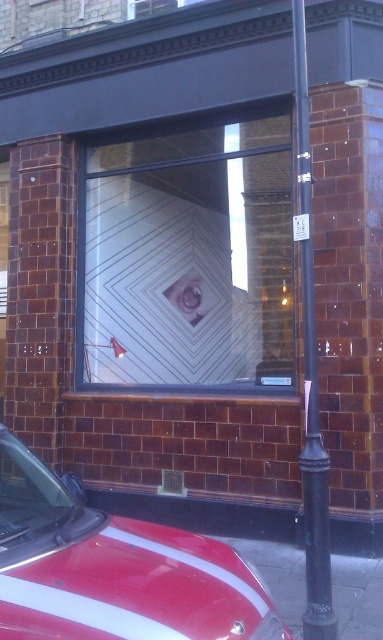
Question: Estimate the real-world distances between objects in this image. Which object is farther from the shiny red car at lower left?

Choices:
 (A) matte white eye at center
 (B) metallic silver lamp post at center
 (C) white matte wall at center

Answer: (A)

Question: Can you confirm if white matte wall at center is thinner than shiny red car at lower left?

Choices:
 (A) no
 (B) yes

Answer: (A)

Question: Can you confirm if white matte wall at center is wider than black metal pole at right?

Choices:
 (A) yes
 (B) no

Answer: (A)

Question: Which point appears closest to the camera in this image?

Choices:
 (A) (168, 582)
 (B) (191, 288)
 (C) (337, 627)

Answer: (A)

Question: Is white matte wall at center closer to the viewer compared to black metal pole at right?

Choices:
 (A) yes
 (B) no

Answer: (B)

Question: Which object is closer to the camera taking this photo?

Choices:
 (A) metallic silver lamp post at center
 (B) white matte wall at center
 (C) black metal pole at right

Answer: (C)